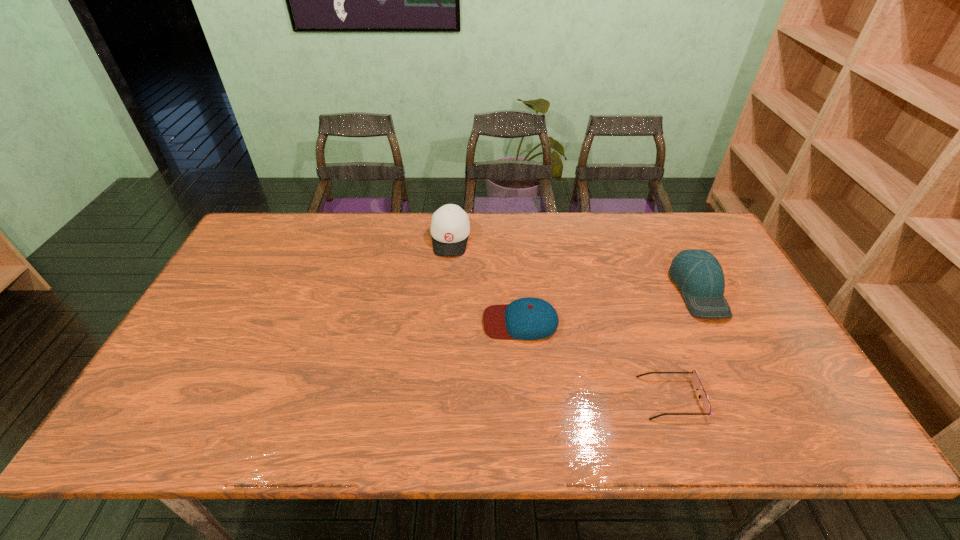
The height and width of the screenshot is (540, 960). I want to click on unoccupied position between the farthest object and the sunglasses, so click(x=561, y=318).

Find the location of a particular element. The width and height of the screenshot is (960, 540). vacant region between the second object from right to left and the second object from left to right is located at coordinates (596, 360).

Locate an element on the screen. vacant space that is in between the leftmost object and the third tallest object is located at coordinates (486, 280).

I want to click on object identified as the second closest to the leftmost object, so click(x=698, y=274).

Locate an element on the screen. the third closest object to the shortest object is located at coordinates (450, 227).

At what (x,y) coordinates should I click in order to perform the action: click on baseball cap that stands as the second closest to the third object from left to right. Please return your answer as a coordinate pair (x, y). Image resolution: width=960 pixels, height=540 pixels. Looking at the image, I should click on (529, 318).

Identify which baseball cap is the nearest to the shortest baseball cap. Please provide its 2D coordinates. Your answer should be formatted as a tuple, i.e. [(x, y)], where the tuple contains the x and y coordinates of a point satisfying the conditions above.

[(450, 227)]

Locate an element on the screen. free location that satisfies the following two spatial constraints: 1. on the front side of the rightmost baseball cap; 2. on the bridge of the third object from left to right is located at coordinates (754, 397).

I want to click on free region that satisfies the following two spatial constraints: 1. on the front side of the rightmost object; 2. on the bridge of the second object from right to left, so click(x=754, y=397).

Where is `vacant space that satisfies the following two spatial constraints: 1. on the front side of the rightmost object; 2. on the bridge of the sunglasses`? vacant space that satisfies the following two spatial constraints: 1. on the front side of the rightmost object; 2. on the bridge of the sunglasses is located at coordinates (754, 397).